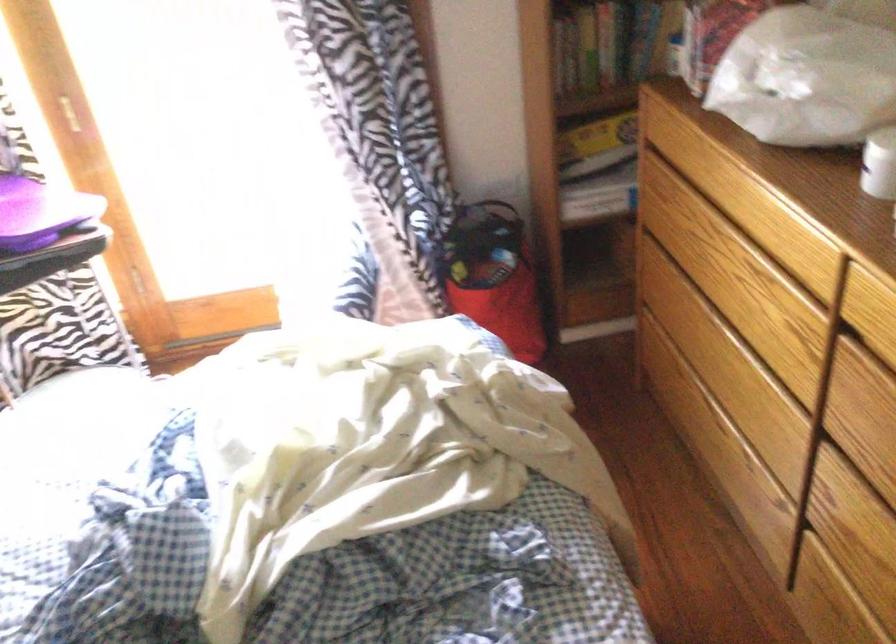
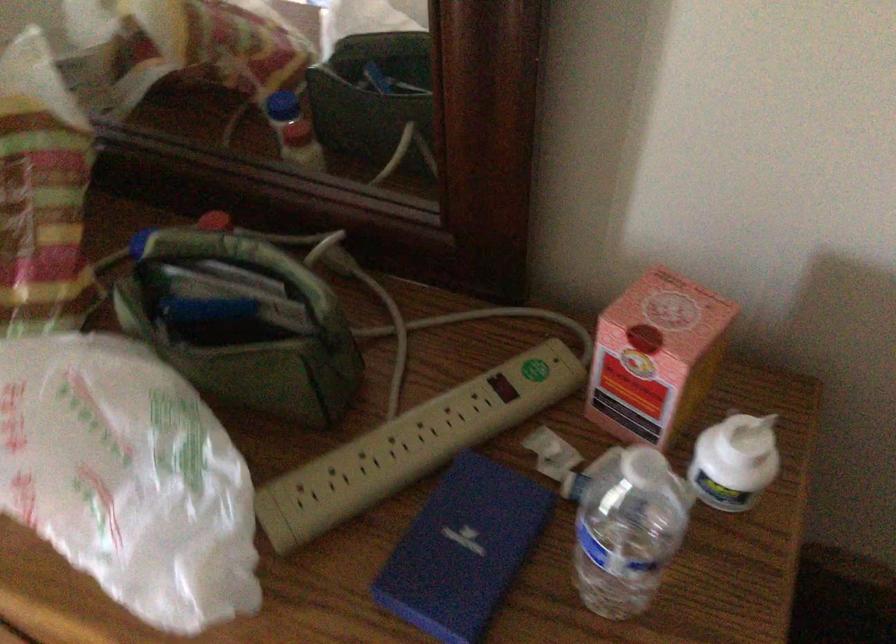
Looking at this image, the first image is from the beginning of the video and the second image is from the end. How did the camera likely rotate when shooting the video?

The rotation direction of the camera is right-down.